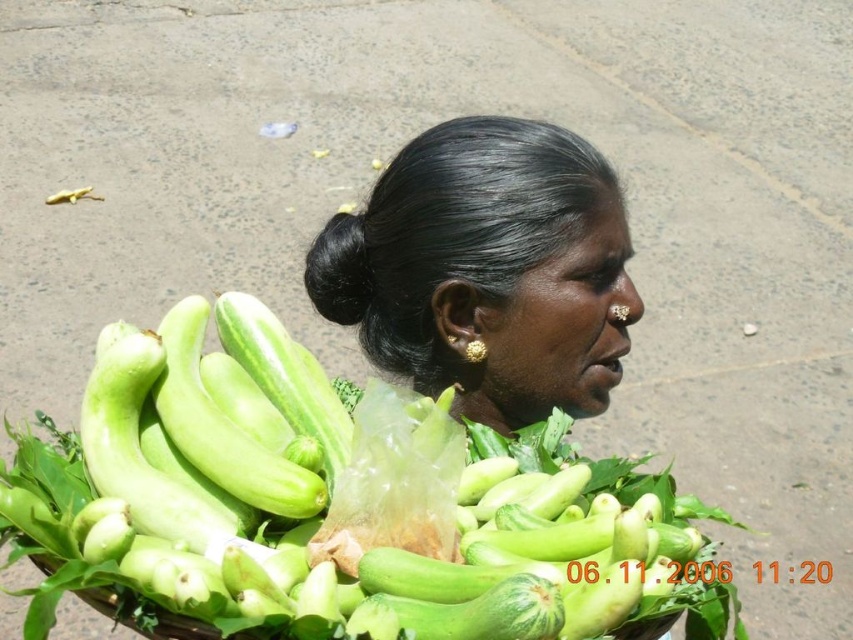
Question: Observing the image, what is the correct spatial positioning of green smooth zucchini at center in reference to black shiny hair at center?

Choices:
 (A) above
 (B) below

Answer: (B)

Question: Among these objects, which one is nearest to the camera?

Choices:
 (A) black shiny hair at center
 (B) green smooth zucchini at center

Answer: (B)

Question: Does green smooth zucchini at center come behind black shiny hair at center?

Choices:
 (A) yes
 (B) no

Answer: (B)

Question: Where is green smooth zucchini at center located in relation to black shiny hair at center in the image?

Choices:
 (A) below
 (B) above

Answer: (A)

Question: Which object appears closest to the camera in this image?

Choices:
 (A) black shiny hair at center
 (B) green smooth zucchini at center

Answer: (B)